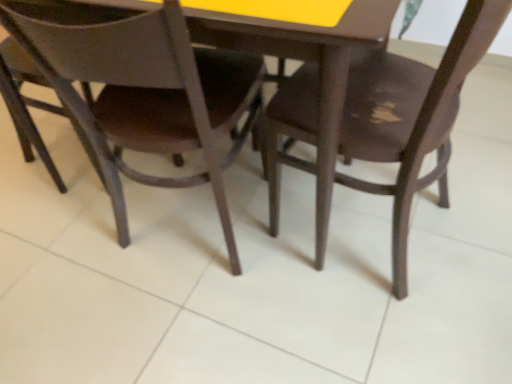
I want to click on dark wood chair at center, which is the 2th chair from left to right, so click(x=381, y=121).

The width and height of the screenshot is (512, 384). What do you see at coordinates (381, 121) in the screenshot? I see `dark wood chair at center, the 1th chair in the right-to-left sequence` at bounding box center [381, 121].

The height and width of the screenshot is (384, 512). What do you see at coordinates (147, 95) in the screenshot?
I see `matte brown chair at center, the 1th chair positioned from the left` at bounding box center [147, 95].

Image resolution: width=512 pixels, height=384 pixels. I want to click on matte brown chair at center, the 2th chair when ordered from right to left, so click(x=147, y=95).

The image size is (512, 384). I want to click on dark wood chair at center, the 1th chair in the right-to-left sequence, so click(381, 121).

Which object is positioned more to the left, dark wood chair at center, which is the 2th chair from left to right, or matte brown chair at center, the 1th chair positioned from the left?

matte brown chair at center, the 1th chair positioned from the left.

Between dark wood chair at center, the 1th chair in the right-to-left sequence, and matte brown chair at center, the 1th chair positioned from the left, which one is positioned behind?

matte brown chair at center, the 1th chair positioned from the left, is further away from the camera.

Which is less distant, (442, 128) or (129, 26)?

Point (442, 128).

From the image's perspective, would you say dark wood chair at center, which is the 2th chair from left to right, is positioned over matte brown chair at center, the 2th chair when ordered from right to left?

No, from the image's perspective, dark wood chair at center, which is the 2th chair from left to right, is not over matte brown chair at center, the 2th chair when ordered from right to left.

From a real-world perspective, does dark wood chair at center, which is the 2th chair from left to right, stand above matte brown chair at center, the 1th chair positioned from the left?

Incorrect, from a real-world perspective, dark wood chair at center, which is the 2th chair from left to right, is lower than matte brown chair at center, the 1th chair positioned from the left.

Looking at their sizes, would you say dark wood chair at center, the 1th chair in the right-to-left sequence, is wider or thinner than matte brown chair at center, the 1th chair positioned from the left?

dark wood chair at center, the 1th chair in the right-to-left sequence, is thinner than matte brown chair at center, the 1th chair positioned from the left.

Who is shorter, dark wood chair at center, the 1th chair in the right-to-left sequence, or matte brown chair at center, the 1th chair positioned from the left?

With less height is matte brown chair at center, the 1th chair positioned from the left.

Can you confirm if dark wood chair at center, the 1th chair in the right-to-left sequence, is bigger than matte brown chair at center, the 2th chair when ordered from right to left?

Yes, dark wood chair at center, the 1th chair in the right-to-left sequence, is bigger than matte brown chair at center, the 2th chair when ordered from right to left.

Is dark wood chair at center, the 1th chair in the right-to-left sequence, situated inside matte brown chair at center, the 1th chair positioned from the left, or outside?

The correct answer is: outside.

Is there a large distance between dark wood chair at center, the 1th chair in the right-to-left sequence, and matte brown chair at center, the 1th chair positioned from the left?

No, dark wood chair at center, the 1th chair in the right-to-left sequence, is in close proximity to matte brown chair at center, the 1th chair positioned from the left.

Could you tell me if dark wood chair at center, the 1th chair in the right-to-left sequence, is facing matte brown chair at center, the 2th chair when ordered from right to left?

Yes, dark wood chair at center, the 1th chair in the right-to-left sequence, is oriented towards matte brown chair at center, the 2th chair when ordered from right to left.

What's the angular difference between dark wood chair at center, the 1th chair in the right-to-left sequence, and matte brown chair at center, the 2th chair when ordered from right to left,'s facing directions?

dark wood chair at center, the 1th chair in the right-to-left sequence, and matte brown chair at center, the 2th chair when ordered from right to left, are facing 76.2 degrees away from each other.

Where is `chair behind the dark wood chair at center, the 1th chair in the right-to-left sequence`? This screenshot has width=512, height=384. chair behind the dark wood chair at center, the 1th chair in the right-to-left sequence is located at coordinates [147, 95].

In the scene shown: Can you confirm if matte brown chair at center, the 1th chair positioned from the left, is positioned to the left of dark wood chair at center, which is the 2th chair from left to right?

Correct, you'll find matte brown chair at center, the 1th chair positioned from the left, to the left of dark wood chair at center, which is the 2th chair from left to right.

Between matte brown chair at center, the 1th chair positioned from the left, and dark wood chair at center, the 1th chair in the right-to-left sequence, which one is positioned in front?

Positioned in front is dark wood chair at center, the 1th chair in the right-to-left sequence.

Between point (240, 60) and point (317, 138), which one is positioned in front?

The point (317, 138) is in front.

From the image's perspective, is matte brown chair at center, the 1th chair positioned from the left, above or below dark wood chair at center, which is the 2th chair from left to right?

From the image's perspective, matte brown chair at center, the 1th chair positioned from the left, appears above dark wood chair at center, which is the 2th chair from left to right.

Based on the photo, from a real-world perspective, which is physically below, matte brown chair at center, the 1th chair positioned from the left, or dark wood chair at center, the 1th chair in the right-to-left sequence?

From a 3D spatial view, dark wood chair at center, the 1th chair in the right-to-left sequence, is below.

Which of these two, matte brown chair at center, the 1th chair positioned from the left, or dark wood chair at center, the 1th chair in the right-to-left sequence, is thinner?

With smaller width is dark wood chair at center, the 1th chair in the right-to-left sequence.

Who is shorter, matte brown chair at center, the 2th chair when ordered from right to left, or dark wood chair at center, the 1th chair in the right-to-left sequence?

With less height is matte brown chair at center, the 2th chair when ordered from right to left.

Considering the sizes of objects matte brown chair at center, the 1th chair positioned from the left, and dark wood chair at center, the 1th chair in the right-to-left sequence, in the image provided, who is smaller, matte brown chair at center, the 1th chair positioned from the left, or dark wood chair at center, the 1th chair in the right-to-left sequence,?

With smaller size is matte brown chair at center, the 1th chair positioned from the left.

Would you say dark wood chair at center, the 1th chair in the right-to-left sequence, is part of matte brown chair at center, the 2th chair when ordered from right to left,'s contents?

No, dark wood chair at center, the 1th chair in the right-to-left sequence, is not surrounded by matte brown chair at center, the 2th chair when ordered from right to left.

Is the surface of matte brown chair at center, the 2th chair when ordered from right to left, in direct contact with dark wood chair at center, the 1th chair in the right-to-left sequence?

matte brown chair at center, the 2th chair when ordered from right to left, and dark wood chair at center, the 1th chair in the right-to-left sequence, are clearly separated.

Is matte brown chair at center, the 2th chair when ordered from right to left, oriented away from dark wood chair at center, which is the 2th chair from left to right?

No, matte brown chair at center, the 2th chair when ordered from right to left, is not facing away from dark wood chair at center, which is the 2th chair from left to right.

What's the angular difference between matte brown chair at center, the 1th chair positioned from the left, and dark wood chair at center, which is the 2th chair from left to right,'s facing directions?

The angular difference between matte brown chair at center, the 1th chair positioned from the left, and dark wood chair at center, which is the 2th chair from left to right, is 76.2 degrees.

Locate an element on the screen. This screenshot has width=512, height=384. chair below the matte brown chair at center, the 2th chair when ordered from right to left (from the image's perspective) is located at coordinates (381, 121).

Where is `chair below the matte brown chair at center, the 1th chair positioned from the left (from the image's perspective)`? chair below the matte brown chair at center, the 1th chair positioned from the left (from the image's perspective) is located at coordinates (381, 121).

This screenshot has width=512, height=384. What are the coordinates of `chair below the matte brown chair at center, the 1th chair positioned from the left (from a real-world perspective)` in the screenshot? It's located at (381, 121).